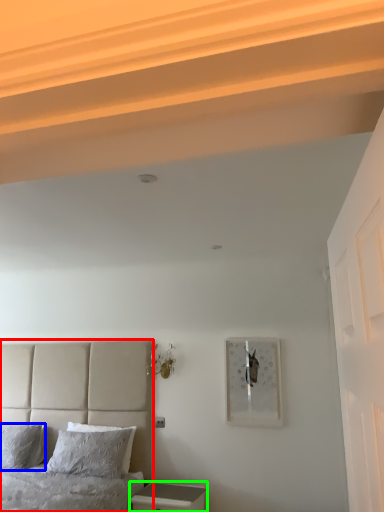
Question: Which object is the farthest from bed (highlighted by a red box)? Choose among these: pillow (highlighted by a blue box) or nightstand (highlighted by a green box).

Choices:
 (A) pillow
 (B) nightstand

Answer: (B)